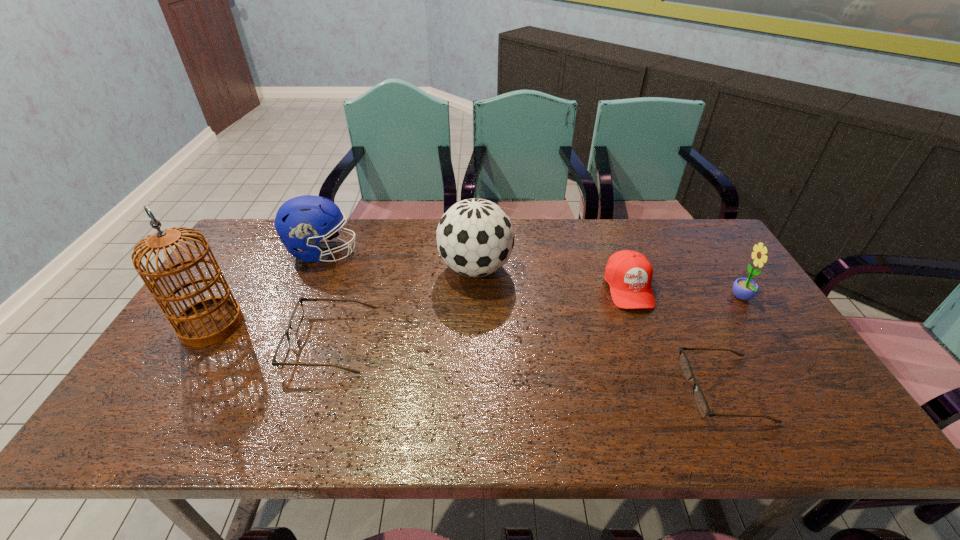
The image size is (960, 540). Identify the location of free space between the shortest object and the leftmost object. (468, 356).

Locate an element on the screen. The width and height of the screenshot is (960, 540). free area in between the tallest object and the shortest object is located at coordinates (468, 356).

The width and height of the screenshot is (960, 540). What are the coordinates of `empty space between the sunflower and the football helmet` in the screenshot? It's located at (533, 275).

The image size is (960, 540). What are the coordinates of `the closest object relative to the fifth tallest object` in the screenshot? It's located at (699, 398).

Image resolution: width=960 pixels, height=540 pixels. What are the coordinates of `the fifth closest object relative to the birdcage` in the screenshot? It's located at (699, 398).

The width and height of the screenshot is (960, 540). Identify the location of free space that satisfies the following two spatial constraints: 1. on the front-facing side of the fourth object from left to right; 2. on the right side of the football helmet. (316, 268).

This screenshot has height=540, width=960. Identify the location of vacant space that satisfies the following two spatial constraints: 1. on the front-facing side of the sunflower; 2. on the front side of the tallest object. (759, 325).

Find the location of a particular element. free region that satisfies the following two spatial constraints: 1. on the front-facing side of the rightmost object; 2. on the front side of the leftmost object is located at coordinates (759, 325).

The height and width of the screenshot is (540, 960). I want to click on free spot that satisfies the following two spatial constraints: 1. on the front-facing side of the football helmet; 2. on the front side of the leftmost object, so click(291, 325).